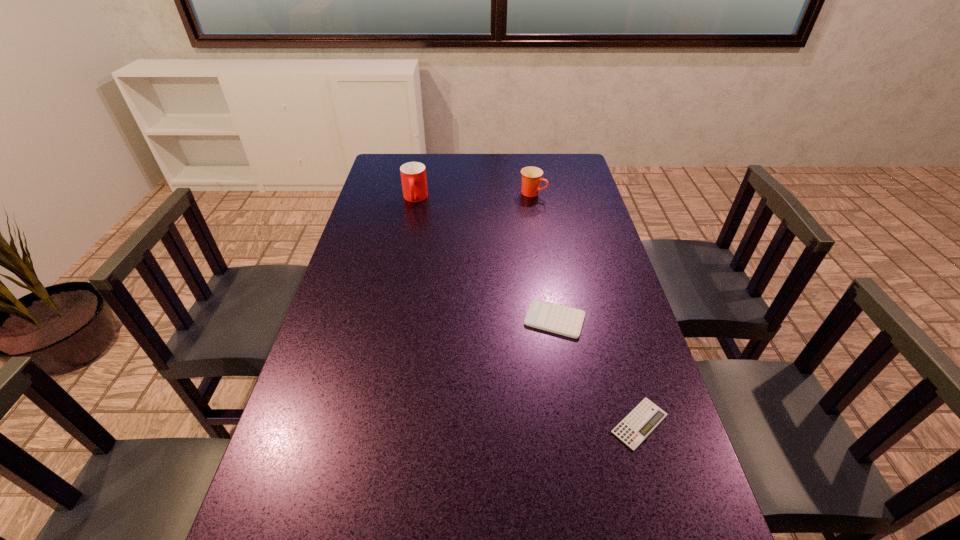
Where is `unoccupied area between the second tallest object and the nearer calculator`? The width and height of the screenshot is (960, 540). unoccupied area between the second tallest object and the nearer calculator is located at coordinates (587, 308).

Where is `blank region between the leftmost object and the second tallest object`? blank region between the leftmost object and the second tallest object is located at coordinates (474, 196).

Image resolution: width=960 pixels, height=540 pixels. In order to click on free area in between the farther calculator and the left cup in this screenshot , I will do `click(485, 259)`.

Find the location of a particular element. Image resolution: width=960 pixels, height=540 pixels. free space between the second tallest object and the left cup is located at coordinates (474, 196).

You are a GUI agent. You are given a task and a screenshot of the screen. Output one action in this format:
    pyautogui.click(x=<x>, y=<y>)
    Task: Click on the vacant area between the shorter cup and the shortest object
    The width and height of the screenshot is (960, 540).
    Given the screenshot: What is the action you would take?
    pyautogui.click(x=587, y=308)

Where is `free point between the third shortest object and the tallest object`? free point between the third shortest object and the tallest object is located at coordinates (474, 196).

The width and height of the screenshot is (960, 540). I want to click on object that is the nearest to the nearer calculator, so click(x=555, y=318).

Locate an element on the screen. This screenshot has height=540, width=960. object identified as the closest to the shorter cup is located at coordinates (413, 174).

What are the coordinates of `free spot that satisfies the following two spatial constraints: 1. on the front side of the shorter calculator; 2. on the left side of the taller calculator` in the screenshot? It's located at (572, 423).

This screenshot has height=540, width=960. Identify the location of free location that satisfies the following two spatial constraints: 1. on the side of the tallest object with the handle; 2. on the left side of the shortest object. (370, 423).